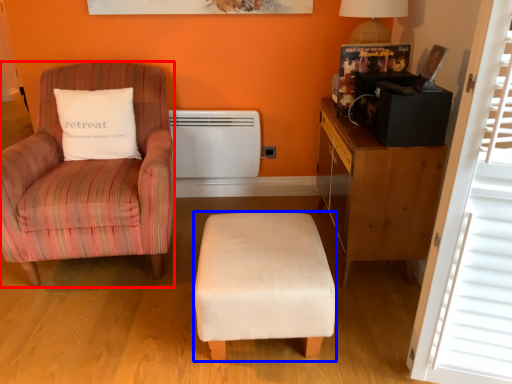
Question: Which of the following is the farthest to the observer, chair (highlighted by a red box) or stool (highlighted by a blue box)?

Choices:
 (A) chair
 (B) stool

Answer: (A)